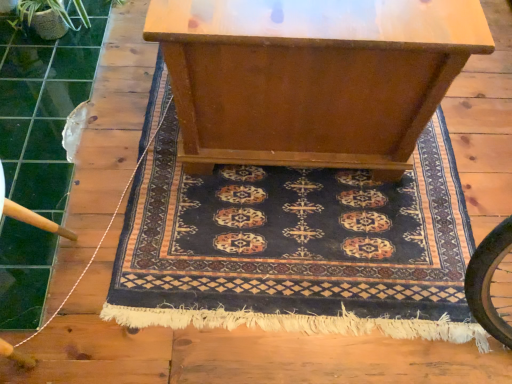
This screenshot has height=384, width=512. Describe the element at coordinates (295, 247) in the screenshot. I see `dark blue woven rug at center` at that location.

Where is `wooden table at center`? This screenshot has height=384, width=512. wooden table at center is located at coordinates (311, 77).

Which is in front, point (335, 285) or point (362, 137)?

The point (335, 285) is in front.

Considering the sizes of objects dark blue woven rug at center and wooden table at center in the image provided, who is wider, dark blue woven rug at center or wooden table at center?

dark blue woven rug at center.

Is dark blue woven rug at center inside or outside of wooden table at center?

dark blue woven rug at center is located beyond the bounds of wooden table at center.

From the image's perspective, is dark blue woven rug at center beneath wooden table at center?

Correct, dark blue woven rug at center appears lower than wooden table at center in the image.

From a real-world perspective, which is physically above, white string at left or green textured plant at upper left?

From a 3D spatial view, green textured plant at upper left is above.

Between white string at left and green textured plant at upper left, which one appears on the left side from the viewer's perspective?

Positioned to the left is white string at left.

Based on the photo, is white string at left wider or thinner than green textured plant at upper left?

Clearly, white string at left has more width compared to green textured plant at upper left.

Locate an element on the screen. The image size is (512, 384). plant to the right of white string at left is located at coordinates pyautogui.click(x=42, y=18).

Between green textured plant at upper left and wooden table at center, which one has more height?

wooden table at center is taller.

Consider the image. Can you tell me how much green textured plant at upper left and wooden table at center differ in facing direction?

There is a 86.2-degree angle between the facing directions of green textured plant at upper left and wooden table at center.

Which of these two, green textured plant at upper left or wooden table at center, is bigger?

Bigger between the two is wooden table at center.

From a real-world perspective, between white string at left and wooden table at center, who is vertically higher?

wooden table at center.

Based on their positions, is white string at left located to the left or right of wooden table at center?

Clearly, white string at left is on the left of wooden table at center in the image.

Considering the points (21, 344) and (339, 41), which point is in front, point (21, 344) or point (339, 41)?

The point (339, 41) is more forward.

Is white string at left thinner than wooden table at center?

Indeed, white string at left has a lesser width compared to wooden table at center.

Can you confirm if wooden table at center is positioned to the right of dark blue woven rug at center?

Yes, wooden table at center is to the right of dark blue woven rug at center.

Is point (189, 47) closer or farther from the camera than point (418, 234)?

Point (189, 47) is positioned closer to the camera compared to point (418, 234).

In the scene shown: Is wooden table at center not near dark blue woven rug at center?

No, there isn't a large distance between wooden table at center and dark blue woven rug at center.

Can you tell me how much wooden table at center and dark blue woven rug at center differ in facing direction?

wooden table at center and dark blue woven rug at center are facing 90.1 degrees away from each other.

Does dark blue woven rug at center have a greater width compared to green textured plant at upper left?

Indeed, dark blue woven rug at center has a greater width compared to green textured plant at upper left.

Could you tell me if dark blue woven rug at center is turned towards green textured plant at upper left?

No.

Does dark blue woven rug at center have a greater height compared to green textured plant at upper left?

No, dark blue woven rug at center is not taller than green textured plant at upper left.

From a real-world perspective, which object stands above the other?

green textured plant at upper left is physically above.

Is green textured plant at upper left bigger than white string at left?

Actually, green textured plant at upper left might be smaller than white string at left.

Would you say green textured plant at upper left is inside or outside white string at left?

green textured plant at upper left lies outside white string at left.

From a real-world perspective, is green textured plant at upper left over white string at left?

Yes.

From the image's perspective, which one is positioned higher, green textured plant at upper left or white string at left?

green textured plant at upper left.

What are the coordinates of `table located in front of the dark blue woven rug at center` in the screenshot? It's located at (311, 77).

Where is `plant above the white string at left (from the image's perspective)`? plant above the white string at left (from the image's perspective) is located at coordinates click(42, 18).

When comparing their distances from white string at left, does dark blue woven rug at center or wooden table at center seem further?

wooden table at center is further to white string at left.

Which object lies further to the anchor point wooden table at center, white string at left or dark blue woven rug at center?

white string at left.

From the image, which object appears to be nearer to wooden table at center, white string at left or green textured plant at upper left?

white string at left lies closer to wooden table at center than the other object.

Which object lies nearer to the anchor point green textured plant at upper left, white string at left or dark blue woven rug at center?

white string at left is closer to green textured plant at upper left.

Looking at this image, estimate the real-world distances between objects in this image. Which object is further from dark blue woven rug at center, green textured plant at upper left or wooden table at center?

green textured plant at upper left is further to dark blue woven rug at center.

Which object lies nearer to the anchor point white string at left, dark blue woven rug at center or green textured plant at upper left?

dark blue woven rug at center is closer to white string at left.

Which object lies further to the anchor point dark blue woven rug at center, white string at left or green textured plant at upper left?

green textured plant at upper left is positioned further to the anchor dark blue woven rug at center.

When comparing their distances from dark blue woven rug at center, does white string at left or wooden table at center seem closer?

wooden table at center lies closer to dark blue woven rug at center than the other object.

Image resolution: width=512 pixels, height=384 pixels. I want to click on plant between white string at left and dark blue woven rug at center from left to right, so coord(42,18).

The width and height of the screenshot is (512, 384). Find the location of `mat located between green textured plant at upper left and wooden table at center in the left-right direction`. mat located between green textured plant at upper left and wooden table at center in the left-right direction is located at coordinates (295, 247).

Find the location of `mat located between white string at left and wooden table at center in the left-right direction`. mat located between white string at left and wooden table at center in the left-right direction is located at coordinates (295, 247).

The image size is (512, 384). Identify the location of plant located between white string at left and wooden table at center in the left-right direction. (42, 18).